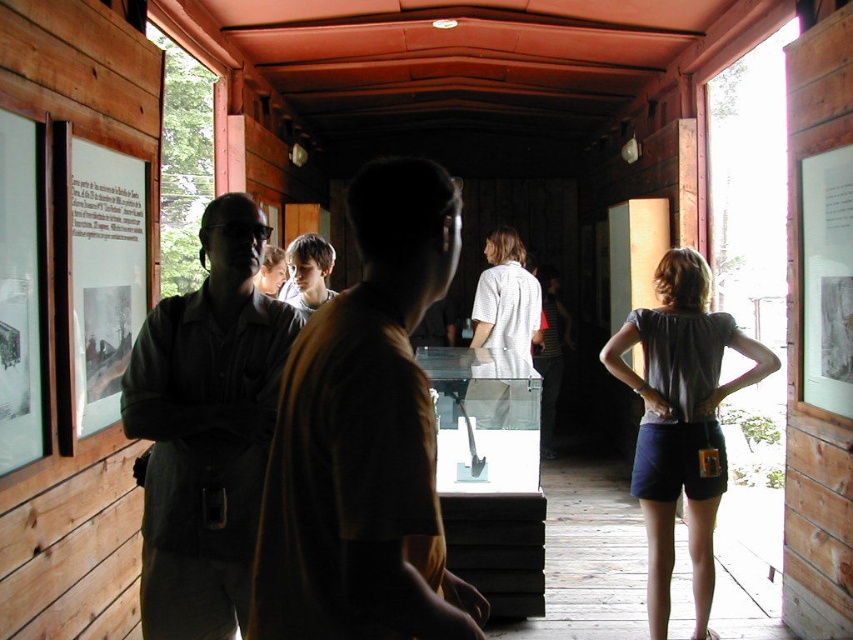
Does gray cotton shirt at right have a greater width compared to light brown hair at center?

Yes, gray cotton shirt at right is wider than light brown hair at center.

Between gray cotton shirt at right and light brown hair at center, which one is positioned lower?

gray cotton shirt at right is below.

Locate an element on the screen. The image size is (853, 640). gray cotton shirt at right is located at coordinates (682, 422).

Is gray cotton shirt at right wider than white matte shirt at center?

Correct, the width of gray cotton shirt at right exceeds that of white matte shirt at center.

Where is `gray cotton shirt at right`? gray cotton shirt at right is located at coordinates (682, 422).

Is dark green uniform at left thinner than gray cotton shirt at right?

Indeed, dark green uniform at left has a lesser width compared to gray cotton shirt at right.

Does point (244, 212) come closer to viewer compared to point (683, 472)?

That is True.

Locate an element on the screen. The height and width of the screenshot is (640, 853). dark green uniform at left is located at coordinates (206, 428).

The image size is (853, 640). What are the coordinates of `dark green uniform at left` in the screenshot? It's located at click(206, 428).